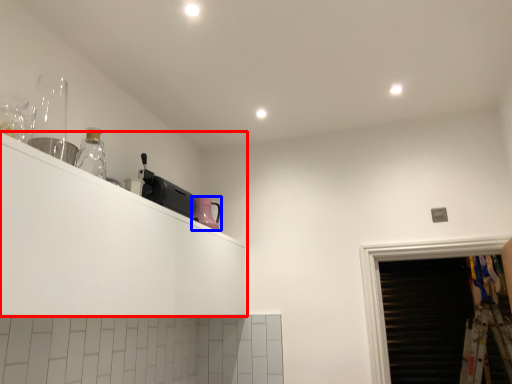
Question: Which object is closer to the camera taking this photo, shelf (highlighted by a red box) or appliance (highlighted by a blue box)?

Choices:
 (A) shelf
 (B) appliance

Answer: (A)